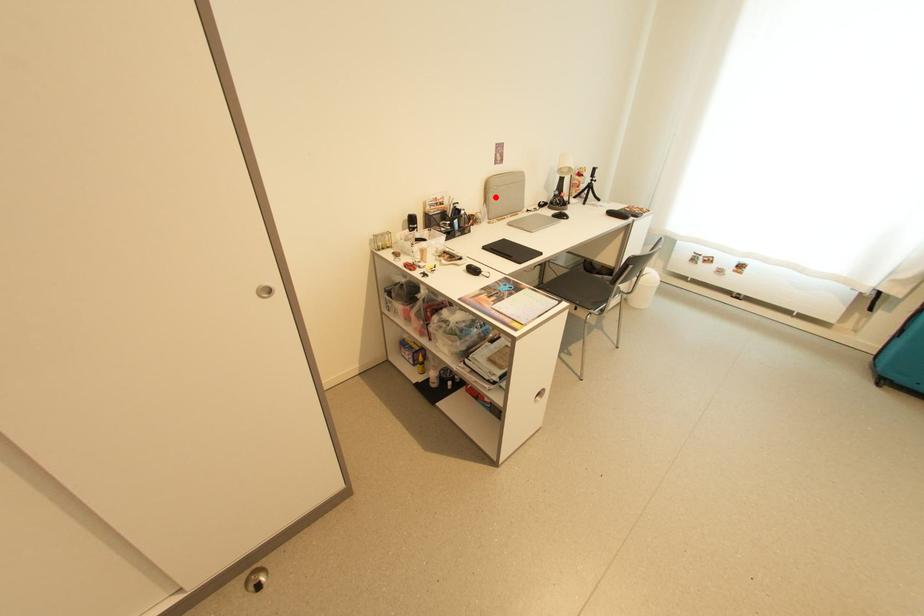
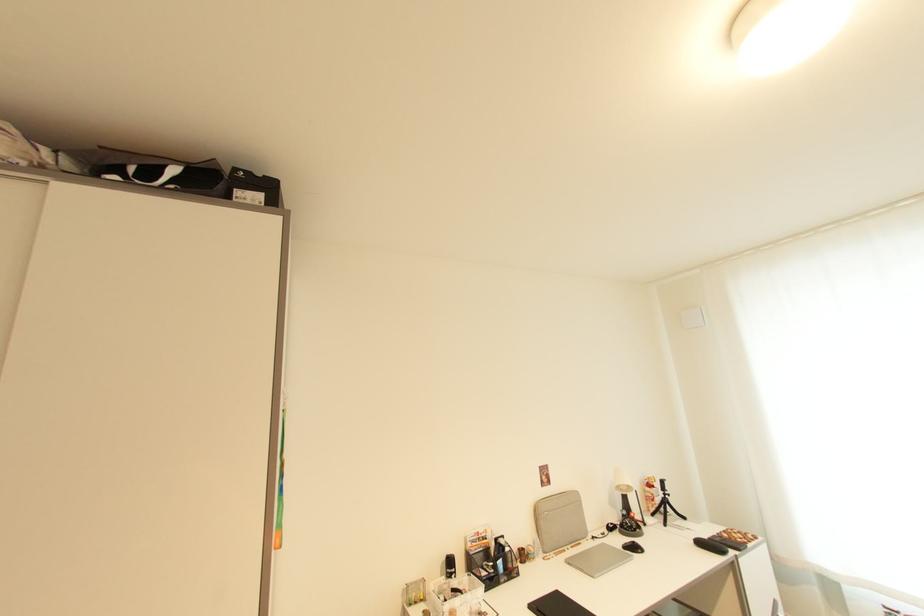
Question: A red point is marked in image1. In image2, is the corresponding 3D point closer to the camera or farther? Reply with the corresponding letter.

Choices:
 (A) The corresponding 3D point is closer.
 (B) The corresponding 3D point is farther.

Answer: (B)